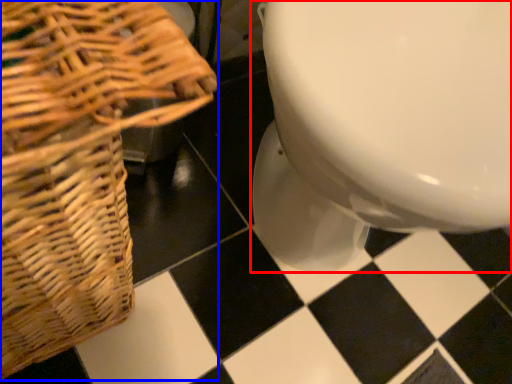
Question: Which point is further to the camera, toilet (highlighted by a red box) or picnic basket (highlighted by a blue box)?

Choices:
 (A) toilet
 (B) picnic basket

Answer: (A)